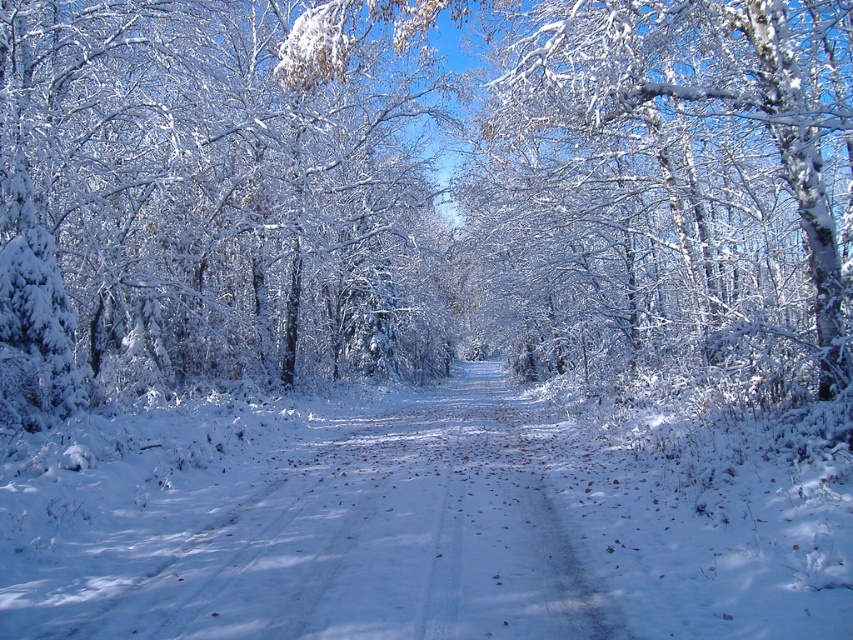
Is white frosty tree at left thinner than white snow-covered path at center?

Incorrect, white frosty tree at left's width is not less than white snow-covered path at center's.

Between point (74, 404) and point (183, 600), which one is positioned behind?

The point (74, 404) is behind.

Does point (148, 113) come in front of point (450, 604)?

That is False.

Locate an element on the screen. Image resolution: width=853 pixels, height=640 pixels. white frosty tree at left is located at coordinates (201, 204).